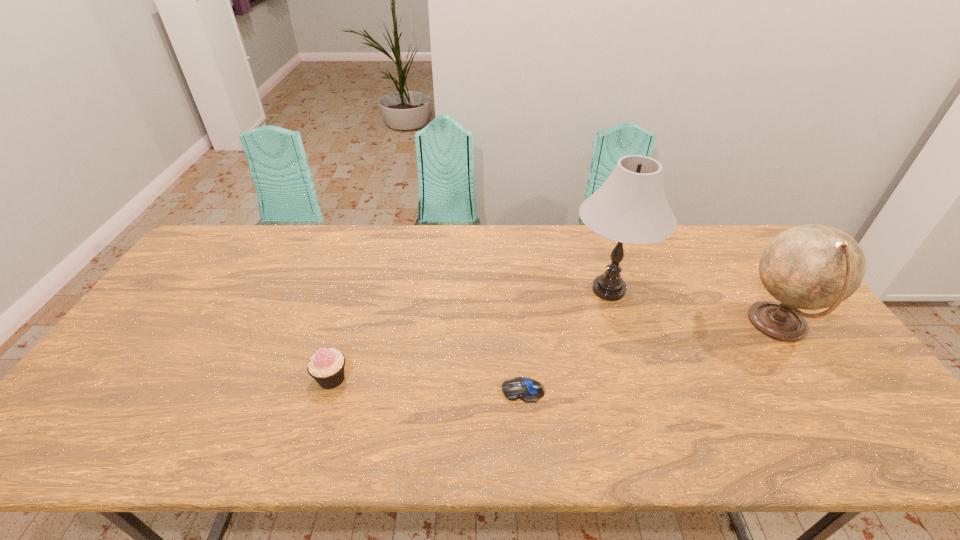
At what (x,y) coordinates should I click in order to perform the action: click on free space located 0.260m on the front-facing side of the rightmost object. Please return your answer as a coordinate pair (x, y). The width and height of the screenshot is (960, 540). Looking at the image, I should click on (648, 325).

The image size is (960, 540). I want to click on blank space located 0.130m on the front-facing side of the rightmost object, so click(x=693, y=325).

The height and width of the screenshot is (540, 960). What are the coordinates of `free space located 0.400m on the back of the third tallest object` in the screenshot? It's located at point(366,266).

You are a GUI agent. You are given a task and a screenshot of the screen. Output one action in this format:
    pyautogui.click(x=<x>, y=<y>)
    Task: Click on the vacant space situated on the button side of the computer mouse
    This screenshot has height=540, width=960.
    Given the screenshot: What is the action you would take?
    pyautogui.click(x=392, y=390)

Find the location of `vacant region located on the button side of the computer mouse`. vacant region located on the button side of the computer mouse is located at coordinates (363, 390).

Find the location of a particular element. The height and width of the screenshot is (540, 960). free space located on the button side of the computer mouse is located at coordinates (481, 390).

The image size is (960, 540). I want to click on object located in the far edge section of the desktop, so click(x=630, y=207).

The image size is (960, 540). Find the location of `object that is at the right edge`. object that is at the right edge is located at coordinates tap(813, 266).

In the image, there is a desktop. At what (x,y) coordinates should I click in order to perform the action: click on vacant space at the far edge. Please return your answer as a coordinate pair (x, y). Looking at the image, I should click on (687, 258).

Locate an element on the screen. Image resolution: width=960 pixels, height=540 pixels. free spot at the near edge of the desktop is located at coordinates (335, 428).